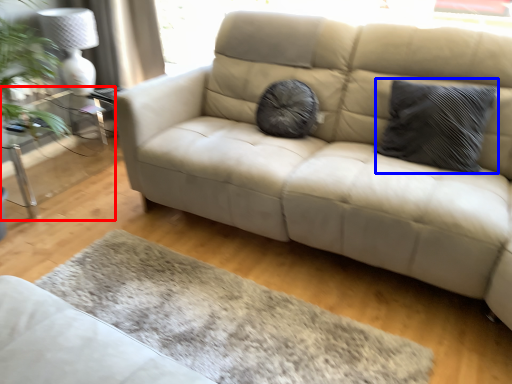
Question: Which of the following is the closest to the observer, table (highlighted by a red box) or pillow (highlighted by a blue box)?

Choices:
 (A) table
 (B) pillow

Answer: (B)